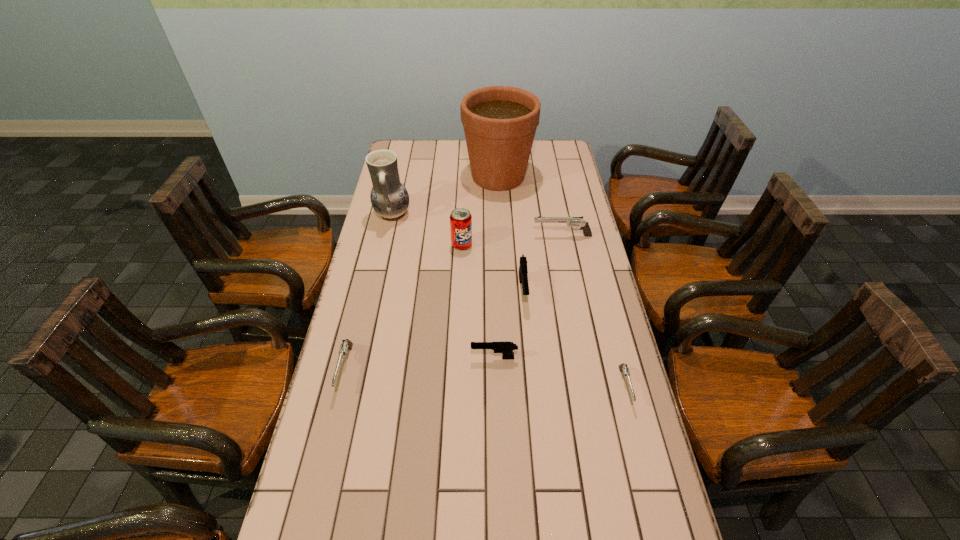
Where is `flowerpot`? The image size is (960, 540). flowerpot is located at coordinates (500, 122).

At what (x,y) coordinates should I click in order to perform the action: click on the tallest object. Please return your answer as a coordinate pair (x, y). Looking at the image, I should click on (500, 122).

I want to click on blue pottery, so click(x=390, y=199).

The image size is (960, 540). Find the location of `pottery`. pottery is located at coordinates (390, 199).

At what (x,y) coordinates should I click in order to perform the action: click on the sixth shortest object. Please return your answer as a coordinate pair (x, y). The height and width of the screenshot is (540, 960). Looking at the image, I should click on (460, 218).

The height and width of the screenshot is (540, 960). In order to click on soda can in this screenshot , I will do `click(460, 218)`.

Where is `the fourth nearest object`? The image size is (960, 540). the fourth nearest object is located at coordinates (523, 271).

Identify the location of the right black pistol. This screenshot has width=960, height=540. (523, 271).

Where is `the farthest pistol`? the farthest pistol is located at coordinates (570, 221).

Where is `the farthest silver pistol`? The width and height of the screenshot is (960, 540). the farthest silver pistol is located at coordinates point(570,221).